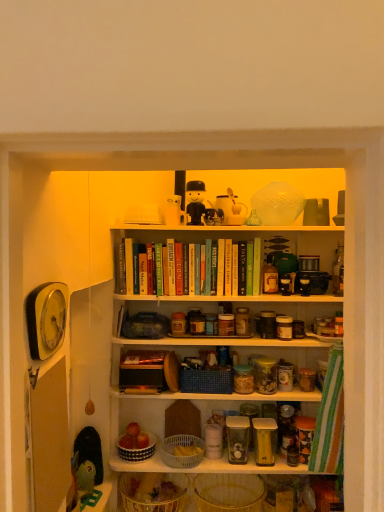
What do you see at coordinates (82, 480) in the screenshot? The height and width of the screenshot is (512, 384). I see `green plastic toy at lower left, which is the 4th toy from right to left` at bounding box center [82, 480].

Describe the element at coordinates (207, 380) in the screenshot. The height and width of the screenshot is (512, 384). I see `blue woven basket at center, the 1th basket when ordered from top to bottom` at that location.

The image size is (384, 512). Describe the element at coordinates (137, 450) in the screenshot. I see `black-and-white ceramic bowl at center, the fourth basket when ordered from bottom to top` at that location.

How much space does black-and-white ceramic bowl at center, which appears as the 2th basket when viewed from the top, occupy horizontally?

black-and-white ceramic bowl at center, which appears as the 2th basket when viewed from the top, is 8.44 inches in width.

What do you see at coordinates (237, 439) in the screenshot? I see `clear glass jar at center` at bounding box center [237, 439].

This screenshot has width=384, height=512. I want to click on yellow wicker basket at lower center, acting as the fourth basket starting from the top, so click(x=228, y=492).

The height and width of the screenshot is (512, 384). In order to click on green plastic toy at lower left, marked as the second toy in a front-to-back arrangement in this screenshot , I will do `click(82, 480)`.

Which of these two, matte plastic toy at upper center, which appears as the second toy when viewed from the back, or green plastic toy at lower left, marked as the 2th toy in a left-to-right arrangement, is thinner?

matte plastic toy at upper center, which appears as the second toy when viewed from the back, is thinner.

Could you measure the distance between matte plastic toy at upper center, the 3th toy viewed from the front, and green plastic toy at lower left, which appears as the 1th toy when viewed from the front?

matte plastic toy at upper center, the 3th toy viewed from the front, is 1.13 meters away from green plastic toy at lower left, which appears as the 1th toy when viewed from the front.

From a real-world perspective, between matte plastic toy at upper center, the third toy in the left-to-right sequence, and green plastic toy at lower left, which is the 3th toy in right-to-left order, who is vertically lower?

green plastic toy at lower left, which is the 3th toy in right-to-left order, from a real-world perspective.

Can clear glass jar at center be found inside black-and-white ceramic bowl at center, the fourth basket when ordered from bottom to top?

Actually, clear glass jar at center is outside black-and-white ceramic bowl at center, the fourth basket when ordered from bottom to top.

Identify the location of glass jar located on the right of black-and-white ceramic bowl at center, which appears as the 2th basket when viewed from the top. This screenshot has width=384, height=512. (237, 439).

Considering the points (150, 453) and (232, 421), which point is behind, point (150, 453) or point (232, 421)?

The point (232, 421) is behind.

From the picture: Which of these two, black-and-white ceramic bowl at center, which appears as the 2th basket when viewed from the top, or clear glass jar at center, is bigger?

black-and-white ceramic bowl at center, which appears as the 2th basket when viewed from the top.

From the picture: Is white plastic basket at center, the third basket when ordered from bottom to top, facing away from matte plastic toy at upper center, which ranks as the 1th toy in top-to-bottom order?

No, white plastic basket at center, the third basket when ordered from bottom to top, is not facing away from matte plastic toy at upper center, which ranks as the 1th toy in top-to-bottom order.

Who is shorter, white plastic basket at center, the third basket when ordered from bottom to top, or matte plastic toy at upper center, acting as the second toy starting from the right?

Standing shorter between the two is white plastic basket at center, the third basket when ordered from bottom to top.

Is the depth of white plastic basket at center, the third basket positioned from the top, greater than that of matte plastic toy at upper center, the 4th toy when ordered from bottom to top?

No, it is not.

Which is correct: white plastic basket at center, the third basket positioned from the top, is inside green plastic toy at lower left, which is the first toy in bottom-to-top order, or outside of it?

The correct answer is: outside.

From the picture: Is white plastic basket at center, the third basket positioned from the top, wider or thinner than green plastic toy at lower left, which is the 4th toy from right to left?

Clearly, white plastic basket at center, the third basket positioned from the top, has more width compared to green plastic toy at lower left, which is the 4th toy from right to left.

In the image, is white plastic basket at center, the third basket positioned from the top, positioned in front of or behind green plastic toy at lower left, the 3th toy from the back?

white plastic basket at center, the third basket positioned from the top, is behind green plastic toy at lower left, the 3th toy from the back.

From the image's perspective, is white plastic basket at center, the third basket positioned from the top, on green plastic toy at lower left, which ranks as the fourth toy in top-to-bottom order?

No, from the image's perspective, white plastic basket at center, the third basket positioned from the top, is not above green plastic toy at lower left, which ranks as the fourth toy in top-to-bottom order.

Can you confirm if translucent wicker basket at lower center, marked as the 5th basket in a top-to-bottom arrangement, is shorter than matte plastic toy at upper center, which is counted as the second toy, starting from the top?

Yes, translucent wicker basket at lower center, marked as the 5th basket in a top-to-bottom arrangement, is shorter than matte plastic toy at upper center, which is counted as the second toy, starting from the top.

Is matte plastic toy at upper center, the 1th toy viewed from the back, at the back of translucent wicker basket at lower center, which ranks as the 1th basket in bottom-to-top order?

No, translucent wicker basket at lower center, which ranks as the 1th basket in bottom-to-top order, is not facing the opposite direction of matte plastic toy at upper center, the 1th toy viewed from the back.

Relative to matte plastic toy at upper center, the 4th toy positioned from the front, is translucent wicker basket at lower center, marked as the 5th basket in a top-to-bottom arrangement, in front or behind?

Clearly, translucent wicker basket at lower center, marked as the 5th basket in a top-to-bottom arrangement, is in front of matte plastic toy at upper center, the 4th toy positioned from the front.

Which is closer, (151,476) or (239,216)?

Point (151,476) appears to be closer to the viewer than point (239,216).

Looking at this image, considering the positions of objects clear glass jar at center and matte plastic toy at upper center, which appears as the second toy when viewed from the back, in the image provided, who is more to the right, clear glass jar at center or matte plastic toy at upper center, which appears as the second toy when viewed from the back,?

From the viewer's perspective, clear glass jar at center appears more on the right side.

Which is in front, point (236, 423) or point (218, 214)?

The point (218, 214) is more forward.

Is matte plastic toy at upper center, the third toy in the left-to-right sequence, at the back of clear glass jar at center?

No.

From a real-world perspective, which object stands above the other?

matte plastic toy at upper center, the 3th toy viewed from the front, from a real-world perspective.

Does black-and-white ceramic bowl at center, which appears as the 2th basket when viewed from the top, turn towards matte plastic toy at upper center, which appears as the 3th toy when ordered from the bottom?

No, black-and-white ceramic bowl at center, which appears as the 2th basket when viewed from the top, does not turn towards matte plastic toy at upper center, which appears as the 3th toy when ordered from the bottom.

Is black-and-white ceramic bowl at center, which appears as the 2th basket when viewed from the top, closer to the viewer compared to matte plastic toy at upper center, the 4th toy positioned from the front?

Yes.

Is black-and-white ceramic bowl at center, the fourth basket when ordered from bottom to top, not near matte plastic toy at upper center, the 1th toy viewed from the back?

black-and-white ceramic bowl at center, the fourth basket when ordered from bottom to top, is positioned a significant distance from matte plastic toy at upper center, the 1th toy viewed from the back.

From a real-world perspective, does black-and-white ceramic bowl at center, which appears as the 2th basket when viewed from the top, sit lower than matte plastic toy at upper center, the fourth toy in the left-to-right sequence?

Indeed, from a real-world perspective, black-and-white ceramic bowl at center, which appears as the 2th basket when viewed from the top, is positioned beneath matte plastic toy at upper center, the fourth toy in the left-to-right sequence.

Identify the location of toy that is the 2nd one when counting downward from the matte plastic toy at upper center, acting as the second toy starting from the right (from the image's perspective). 86,465.

Where is `glass jar to the right of black-and-white ceramic bowl at center, which appears as the 2th basket when viewed from the top`? The image size is (384, 512). glass jar to the right of black-and-white ceramic bowl at center, which appears as the 2th basket when viewed from the top is located at coordinates (237, 439).

From the image, which object appears to be nearer to green matte book at upper center, blue woven basket at center, the 5th basket from the bottom, or translucent wicker basket at lower center, which ranks as the 1th basket in bottom-to-top order?

blue woven basket at center, the 5th basket from the bottom.

Which object lies further to the anchor point black-and-white ceramic bowl at center, the fourth basket when ordered from bottom to top, translucent wicker basket at lower center, marked as the 5th basket in a top-to-bottom arrangement, or white plastic basket at center, the third basket when ordered from bottom to top?

Result: Based on the image, translucent wicker basket at lower center, marked as the 5th basket in a top-to-bottom arrangement, appears to be further to black-and-white ceramic bowl at center, the fourth basket when ordered from bottom to top.

Which object lies nearer to the anchor point green plastic toy at lower left, the first toy positioned from the left, green matte book at upper center or green plastic toy at lower left, the 4th toy from the back?

Among the two, green plastic toy at lower left, the 4th toy from the back, is located nearer to green plastic toy at lower left, the first toy positioned from the left.

From the image, which object appears to be nearer to green matte book at upper center, green plastic toy at lower left, which is the 4th toy from right to left, or black-and-white ceramic bowl at center, the fourth basket when ordered from bottom to top?

black-and-white ceramic bowl at center, the fourth basket when ordered from bottom to top, is closer to green matte book at upper center.

When comparing their distances from blue woven basket at center, the 5th basket from the bottom, does matte plastic toy at upper center, which ranks as the 1th toy in top-to-bottom order, or translucent wicker basket at lower center, which ranks as the 1th basket in bottom-to-top order, seem further?

matte plastic toy at upper center, which ranks as the 1th toy in top-to-bottom order.

From the image, which object appears to be farther from yellow wicker basket at lower center, placed as the second basket when sorted from bottom to top, translucent wicker basket at lower center, marked as the 5th basket in a top-to-bottom arrangement, or green plastic toy at lower left, the 3th toy from the back?

green plastic toy at lower left, the 3th toy from the back.

Based on their spatial positions, is blue woven basket at center, the 1th basket when ordered from top to bottom, or matte plastic toy at upper center, which is counted as the second toy, starting from the top, closer to translucent wicker basket at lower center, which ranks as the 1th basket in bottom-to-top order?

Among the two, blue woven basket at center, the 1th basket when ordered from top to bottom, is located nearer to translucent wicker basket at lower center, which ranks as the 1th basket in bottom-to-top order.

Estimate the real-world distances between objects in this image. Which object is closer to yellow wicker basket at lower center, acting as the fourth basket starting from the top, green plastic toy at lower left, which ranks as the fourth toy in top-to-bottom order, or blue woven basket at center, the 1th basket when ordered from top to bottom?

blue woven basket at center, the 1th basket when ordered from top to bottom, lies closer to yellow wicker basket at lower center, acting as the fourth basket starting from the top, than the other object.

This screenshot has width=384, height=512. In order to click on glass jar that lies between matte plastic toy at upper center, the 3th toy viewed from the front, and white plastic basket at center, the third basket positioned from the top, from top to bottom in this screenshot , I will do `click(237, 439)`.

Identify the location of glass jar between green matte book at upper center and translucent wicker basket at lower center, marked as the 5th basket in a top-to-bottom arrangement, in the vertical direction. The width and height of the screenshot is (384, 512). (237, 439).

Where is `basket between matte plastic toy at upper center, the third toy in the left-to-right sequence, and green plastic toy at lower left, the third toy from the top, in the vertical direction`? basket between matte plastic toy at upper center, the third toy in the left-to-right sequence, and green plastic toy at lower left, the third toy from the top, in the vertical direction is located at coordinates (207, 380).

The image size is (384, 512). I want to click on basket that lies between matte plastic toy at upper center, which appears as the second toy when viewed from the back, and black-and-white ceramic bowl at center, the fourth basket when ordered from bottom to top, from top to bottom, so click(x=207, y=380).